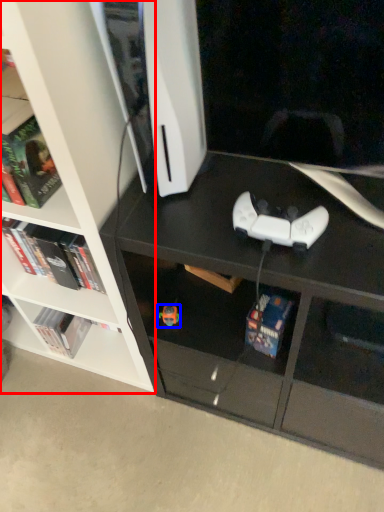
Question: Which point is closer to the camera, bookcase (highlighted by a red box) or toy (highlighted by a blue box)?

Choices:
 (A) bookcase
 (B) toy

Answer: (A)